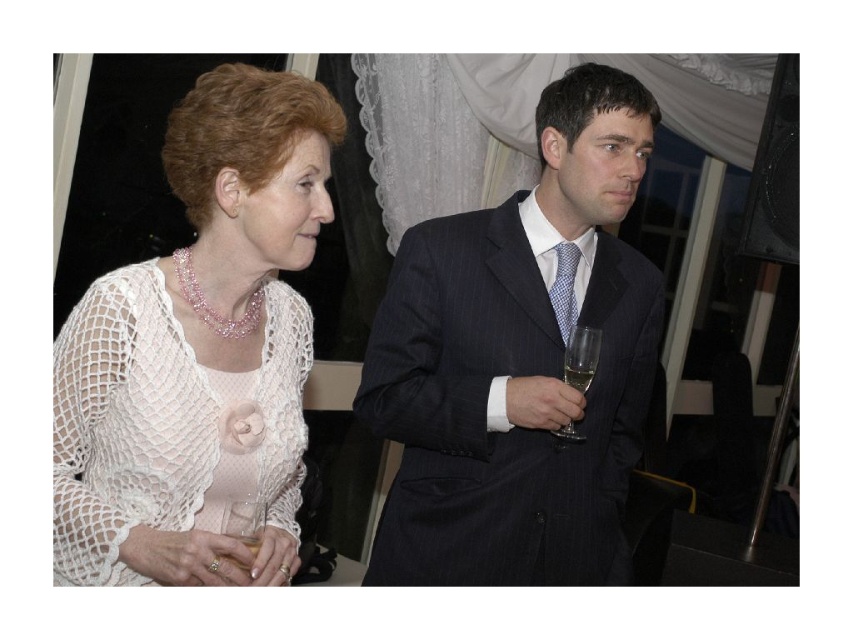
You are a photographer at a formal event. You need to capture a photo of the dark blue pinstripe suit at center and the matte glass at right. Based on their sizes, which object should you focus on first to ensure both are in frame?

The dark blue pinstripe suit at center is larger in size than the matte glass at right, so you should focus on the dark blue pinstripe suit at center first to ensure both fit within the frame.

You are a bartender at the event and need to place a new drink between the clear glass wine glass at right and the clear glass wine glass at lower left. Where should you place it to ensure it is between them?

The new drink should be placed between the clear glass wine glass at right and the clear glass wine glass at lower left. Since the clear glass wine glass at right is above the clear glass wine glass at lower left, the new drink should be placed below the clear glass wine glass at right but above the clear glass wine glass at lower left to be between them.

You are at a formal event and see two people. The woman on the left is wearing a white lace cardigan over a light pink dress with a floral design. The man on the right is in a dark pinstripe suit. A point at coordinates (519, 360) is marked. Which object does this point correspond to?

The point at coordinates (519, 360) corresponds to the dark blue pinstripe suit at center.